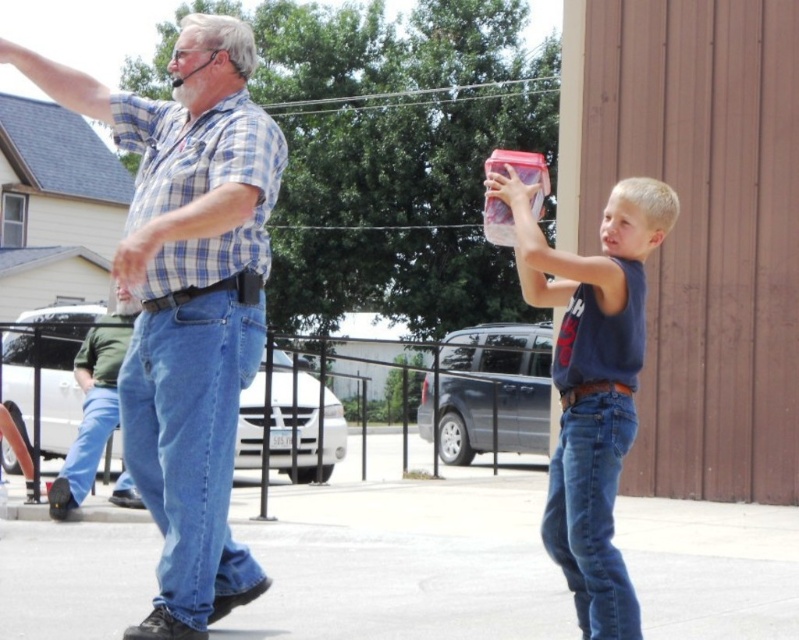
Question: Does blue plaid shirt at upper left have a greater width compared to green cotton shirt at left?

Choices:
 (A) no
 (B) yes

Answer: (B)

Question: Which point appears farthest from the camera in this image?

Choices:
 (A) (507, 198)
 (B) (68, 504)

Answer: (B)

Question: Estimate the real-world distances between objects in this image. Which object is farther from the matte plastic container at center?

Choices:
 (A) green cotton shirt at left
 (B) blue plaid shirt at upper left

Answer: (A)

Question: Does blue plaid shirt at upper left appear on the left side of green cotton shirt at left?

Choices:
 (A) no
 (B) yes

Answer: (A)

Question: From the image, what is the correct spatial relationship of blue plaid shirt at upper left in relation to green cotton shirt at left?

Choices:
 (A) above
 (B) below

Answer: (B)

Question: Estimate the real-world distances between objects in this image. Which object is closer to the blue plaid shirt at upper left?

Choices:
 (A) green cotton shirt at left
 (B) matte plastic container at center

Answer: (B)